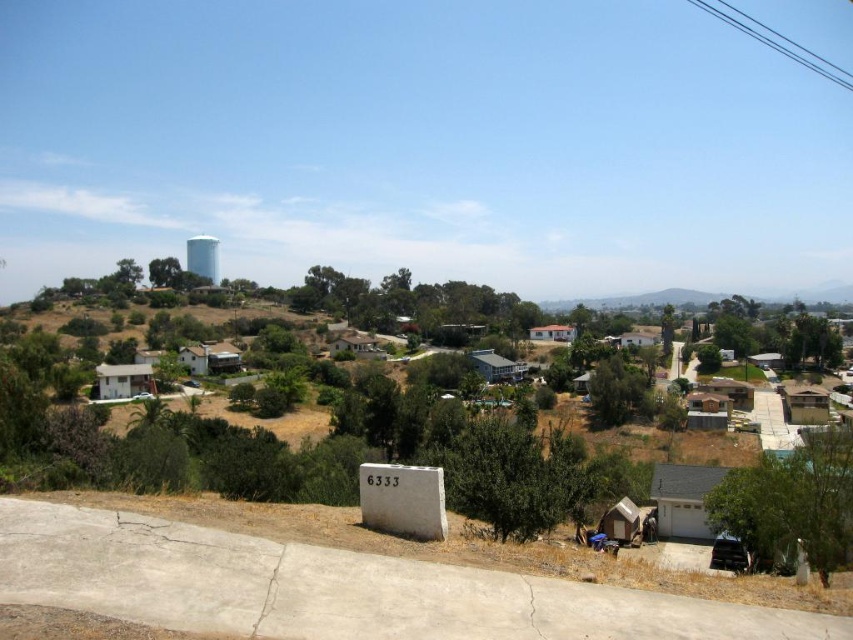
Which is in front, point (318, 280) or point (192, 236)?

Point (318, 280) is in front.

Is point (334, 294) positioned after point (209, 250)?

No, (334, 294) is in front of (209, 250).

Locate an element on the screen. green leafy tree at center is located at coordinates (415, 305).

Between green leafy tree at lower right and blue glossy water tower at upper left, which one appears on the right side from the viewer's perspective?

green leafy tree at lower right is more to the right.

Which is more to the left, green leafy tree at lower right or blue glossy water tower at upper left?

Positioned to the left is blue glossy water tower at upper left.

Identify the location of green leafy tree at lower right. (792, 500).

Is green leafy tree at lower right shorter than green leafy tree at center?

Correct, green leafy tree at lower right is not as tall as green leafy tree at center.

Between point (775, 456) and point (384, 317), which one is positioned behind?

Point (384, 317)

At what (x,y) coordinates should I click in order to perform the action: click on green leafy tree at lower right. Please return your answer as a coordinate pair (x, y). Looking at the image, I should click on (792, 500).